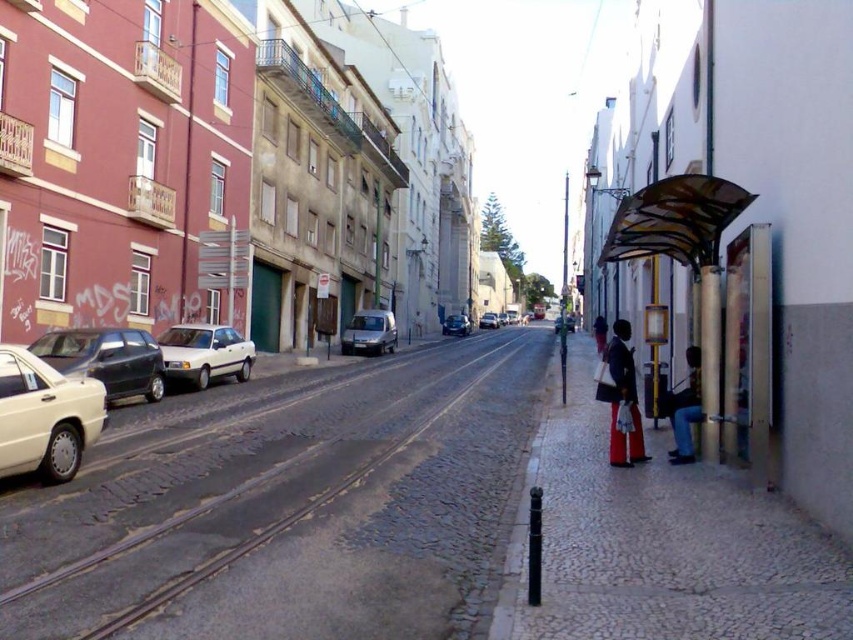
Question: Can you confirm if metallic silver van at center is positioned to the right of shiny silver van at center?

Choices:
 (A) no
 (B) yes

Answer: (A)

Question: Which object appears farthest from the camera in this image?

Choices:
 (A) shiny black sedan at left
 (B) matte silver van at center

Answer: (B)

Question: Is cobblestone train track at center below shiny black sedan at left?

Choices:
 (A) yes
 (B) no

Answer: (A)

Question: Which of the following is the closest to the observer?

Choices:
 (A) matte black jacket at center
 (B) jeans at right
 (C) transparent plastic bus stop at right
 (D) shiny silver van at center

Answer: (C)

Question: Is cobblestone train track at center further to camera compared to white glossy sedan at lower left?

Choices:
 (A) no
 (B) yes

Answer: (A)

Question: Which of the following is the farthest from the observer?

Choices:
 (A) matte black jacket at center
 (B) red fabric traffic cone at center
 (C) white glossy sedan at lower left
 (D) transparent plastic bus stop at right

Answer: (B)